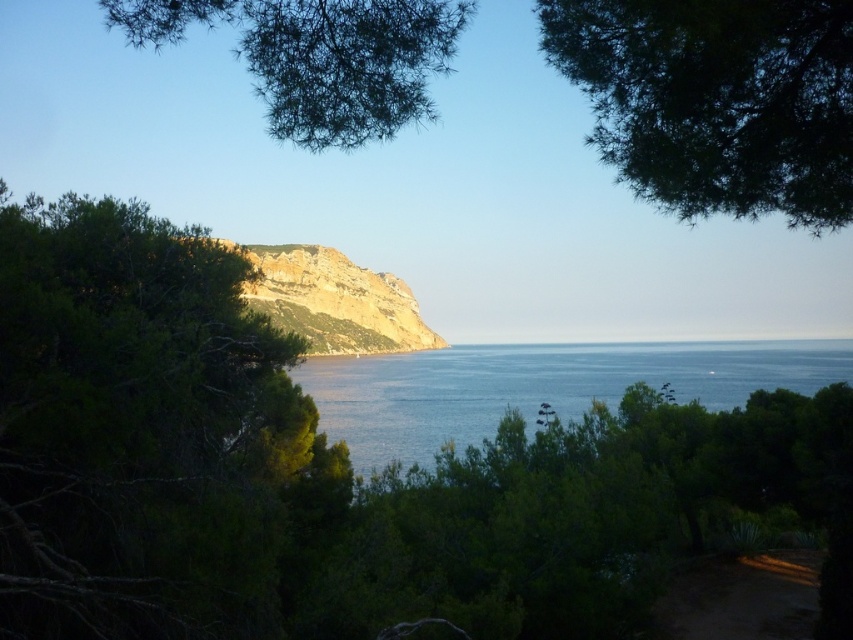
Question: Can you confirm if blue water at center is positioned below green needle-like leaves at upper center?

Choices:
 (A) yes
 (B) no

Answer: (A)

Question: Which object is closer to the camera taking this photo?

Choices:
 (A) dark green leafy tree at upper right
 (B) green needle-like leaves at upper center

Answer: (A)

Question: Does green leafy tree at left come in front of green needle-like leaves at upper center?

Choices:
 (A) yes
 (B) no

Answer: (A)

Question: Which point appears farthest from the camera in this image?

Choices:
 (A) (401, 38)
 (B) (166, 604)
 (C) (535, 384)

Answer: (C)

Question: Can you confirm if green leafy tree at left is positioned below blue water at center?

Choices:
 (A) no
 (B) yes

Answer: (A)

Question: Which object appears farthest from the camera in this image?

Choices:
 (A) dark green leafy tree at upper right
 (B) green needle-like leaves at upper center

Answer: (B)